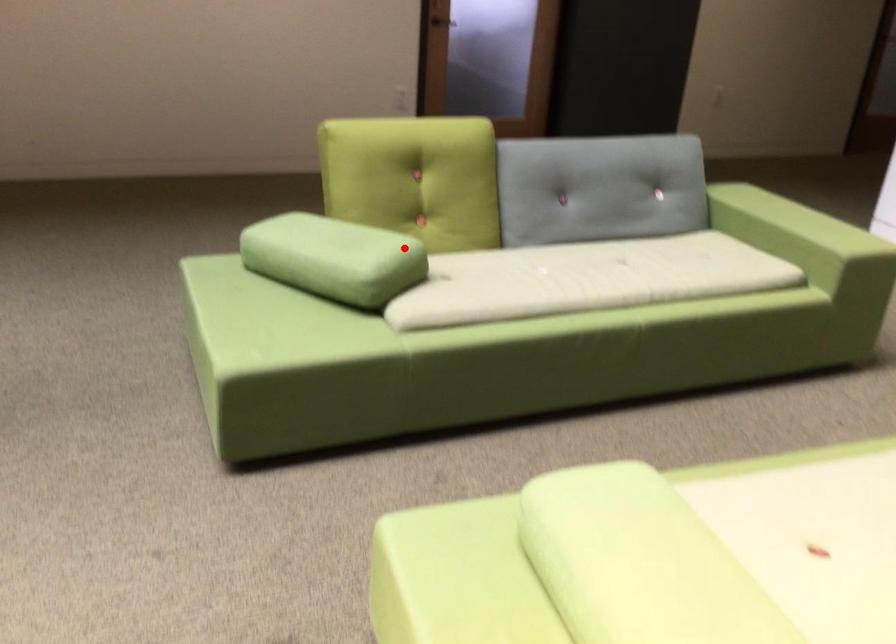
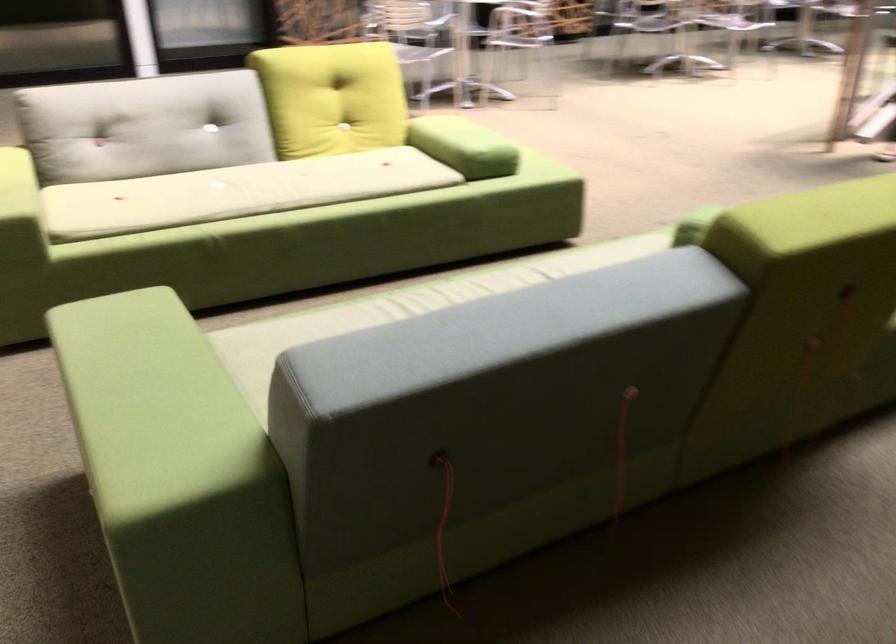
Where in the second image is the point corresponding to the highlighted location from the first image?

(694, 225)